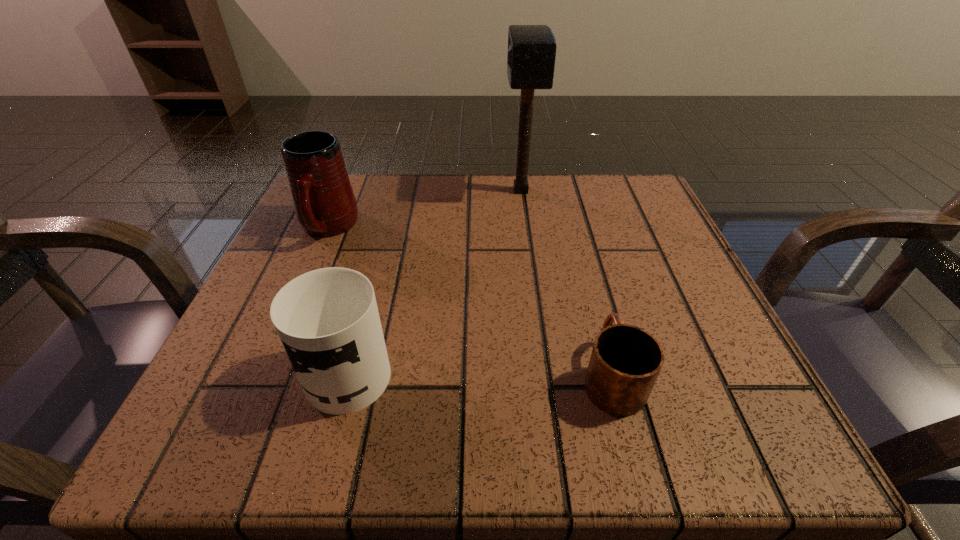
In order to click on object that is at the near right corner in this screenshot , I will do `click(625, 362)`.

The width and height of the screenshot is (960, 540). In order to click on vacant point at the far edge in this screenshot , I will do `click(382, 218)`.

Image resolution: width=960 pixels, height=540 pixels. I want to click on vacant area at the near edge, so click(x=439, y=409).

This screenshot has height=540, width=960. I want to click on vacant space at the left edge, so click(282, 268).

The width and height of the screenshot is (960, 540). Find the location of `vacant region at the right edge of the desktop`. vacant region at the right edge of the desktop is located at coordinates (686, 291).

In the image, there is a desktop. Where is `vacant space at the far right corner`? vacant space at the far right corner is located at coordinates (644, 220).

You are a GUI agent. You are given a task and a screenshot of the screen. Output one action in this format:
    pyautogui.click(x=<x>, y=<y>)
    Task: Click on the free space at the near right corner
    
    Given the screenshot: What is the action you would take?
    pyautogui.click(x=768, y=435)

In order to click on unoccupied position between the third object from left to right and the leftmost object in this screenshot , I will do tap(424, 209).

Find the location of a particular element. The height and width of the screenshot is (540, 960). free space between the mallet and the farthest mug is located at coordinates (424, 209).

Locate an element on the screen. blank region between the farthest mug and the mallet is located at coordinates (424, 209).